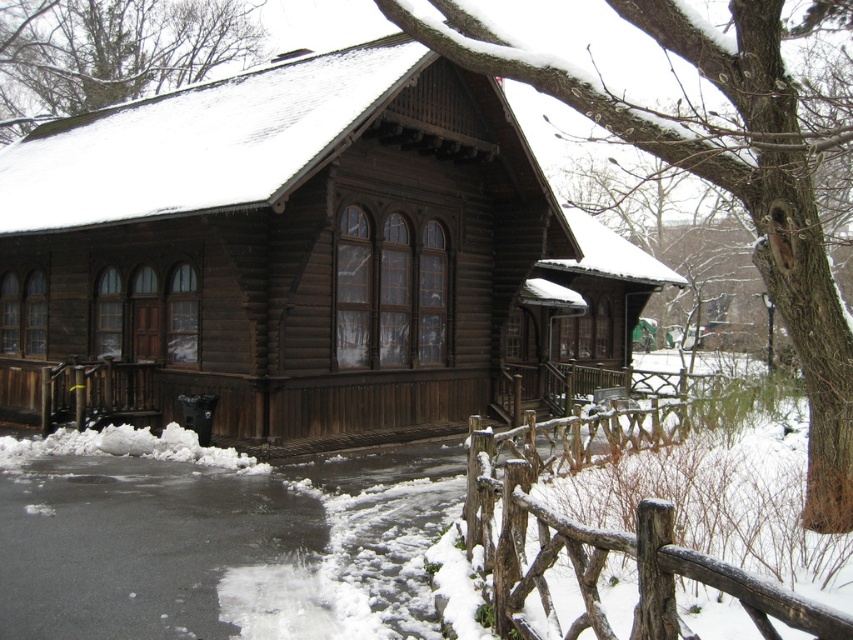
Question: Which point is closer to the camera?

Choices:
 (A) snow-covered wood at upper center
 (B) rustic wooden fence at lower right
 (C) smooth brown bark at center

Answer: (B)

Question: Considering the real-world distances, which object is farthest from the smooth brown bark at center?

Choices:
 (A) rustic wooden fence at lower right
 (B) snow-covered wood at upper center

Answer: (B)

Question: Does smooth brown bark at center appear under rustic wooden fence at lower right?

Choices:
 (A) yes
 (B) no

Answer: (B)

Question: Which object appears closest to the camera in this image?

Choices:
 (A) snow-covered wood at upper center
 (B) smooth brown bark at center
 (C) rustic wooden fence at lower right

Answer: (C)

Question: Does smooth brown bark at center appear on the right side of snow-covered wood at upper center?

Choices:
 (A) no
 (B) yes

Answer: (B)

Question: Does rustic wooden fence at lower right appear on the left side of snow-covered wood at upper center?

Choices:
 (A) no
 (B) yes

Answer: (A)